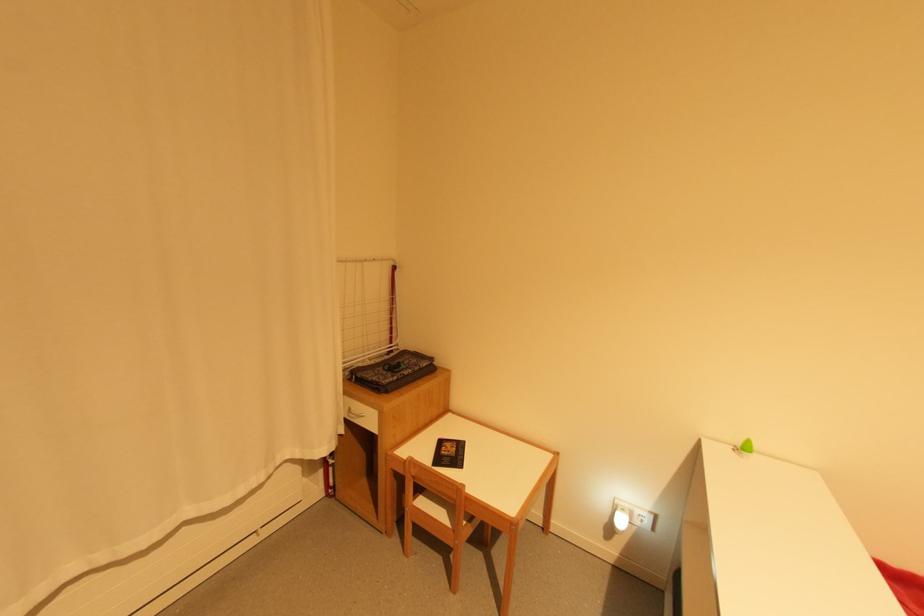
The width and height of the screenshot is (924, 616). Describe the element at coordinates (440, 509) in the screenshot. I see `a wooden chair sitting surface` at that location.